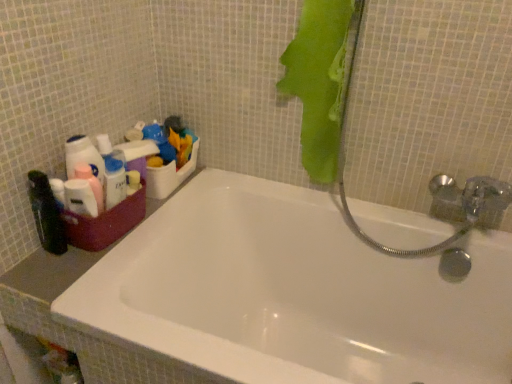
I want to click on white glossy bathtub at center, so click(294, 293).

The width and height of the screenshot is (512, 384). Describe the element at coordinates (294, 293) in the screenshot. I see `white glossy bathtub at center` at that location.

Locate an element on the screen. The image size is (512, 384). white glossy bathtub at center is located at coordinates (294, 293).